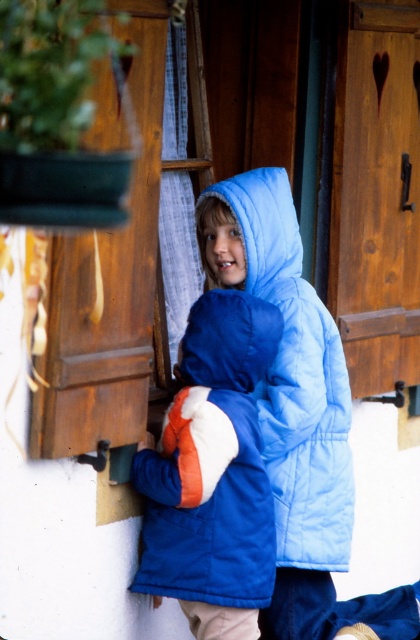
Does point (249, 515) lie in front of point (328, 522)?

Yes, point (249, 515) is in front of point (328, 522).

Measure the distance between blue quilted jacket at center and camera.

blue quilted jacket at center is 3.53 meters away from camera.

Where is `blue quilted jacket at center`? The height and width of the screenshot is (640, 420). blue quilted jacket at center is located at coordinates (212, 465).

This screenshot has width=420, height=640. What are the coordinates of `blue quilted jacket at center` in the screenshot? It's located at tap(212, 465).

Is light blue quilted jacket at center shorter than blue fleece hood at center?

In fact, light blue quilted jacket at center may be taller than blue fleece hood at center.

Does light blue quilted jacket at center have a greater height compared to blue fleece hood at center?

Indeed, light blue quilted jacket at center has a greater height compared to blue fleece hood at center.

The image size is (420, 640). Describe the element at coordinates (296, 380) in the screenshot. I see `light blue quilted jacket at center` at that location.

I want to click on light blue quilted jacket at center, so coord(296,380).

Can you confirm if blue quilted jacket at center is shorter than blue fleece hood at center?

No, blue quilted jacket at center is not shorter than blue fleece hood at center.

Does blue quilted jacket at center appear under blue fleece hood at center?

Yes, blue quilted jacket at center is below blue fleece hood at center.

Measure the distance between point (233, 547) and camera.

Point (233, 547) and camera are 3.68 meters apart.

Find the location of a particular element. This screenshot has width=420, height=640. blue quilted jacket at center is located at coordinates (212, 465).